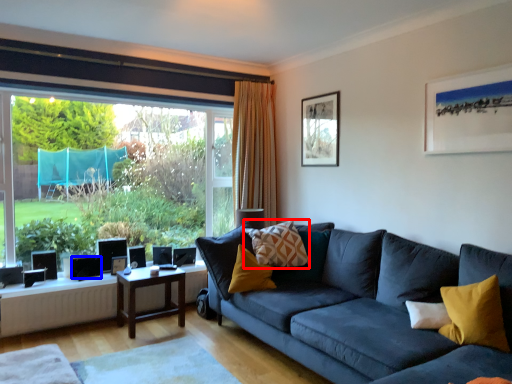
Question: Which of the following is the closest to the observer, pillow (highlighted by a red box) or speaker (highlighted by a blue box)?

Choices:
 (A) pillow
 (B) speaker

Answer: (A)